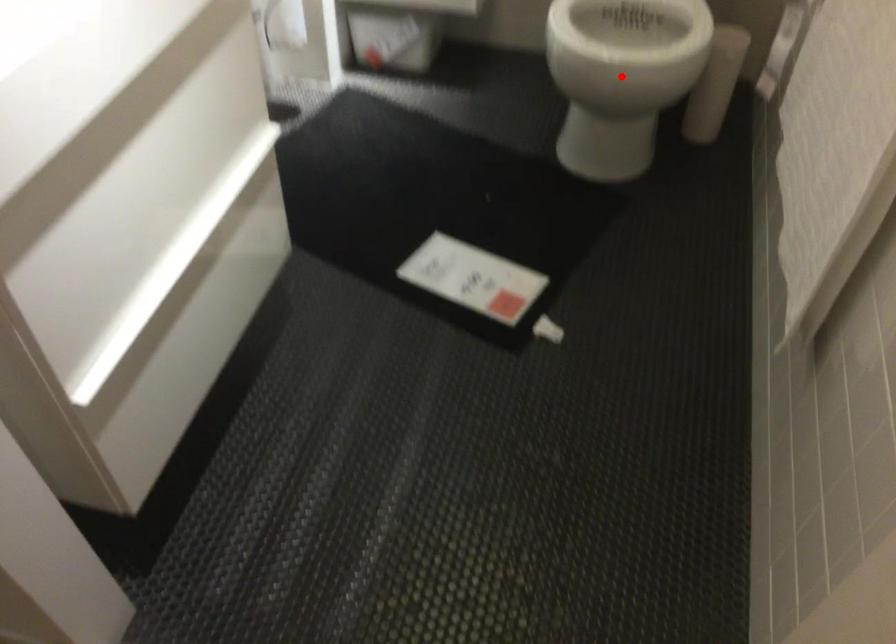
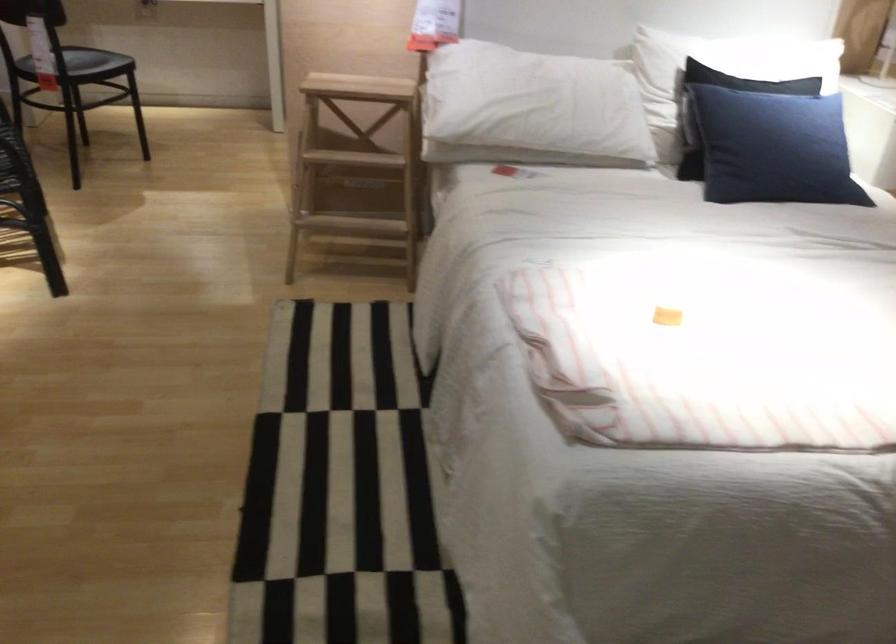
Question: I am providing you with two images of the same scene from different viewpoints. A red point is marked on the first image. Is the red point's position out of view in image 2?

Choices:
 (A) Yes
 (B) No

Answer: (A)